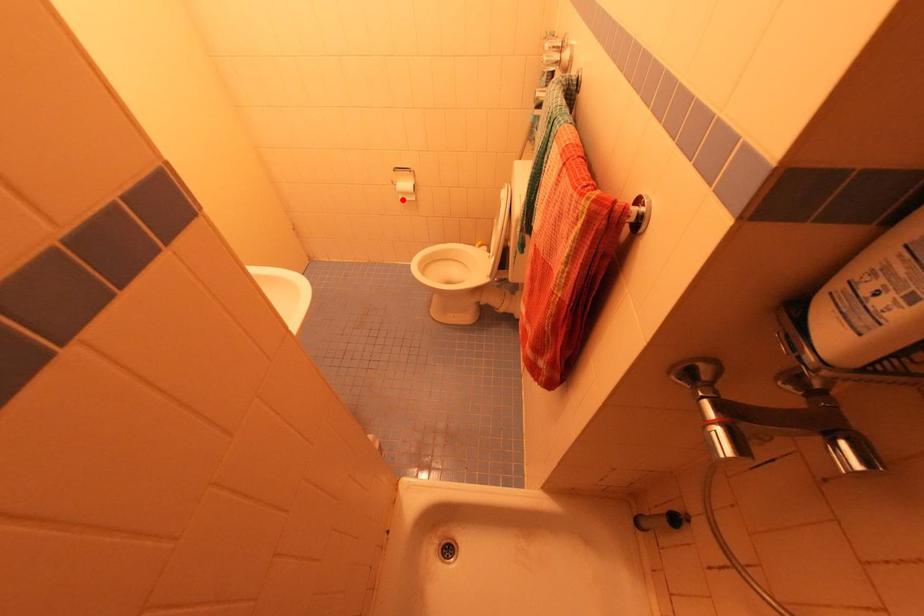
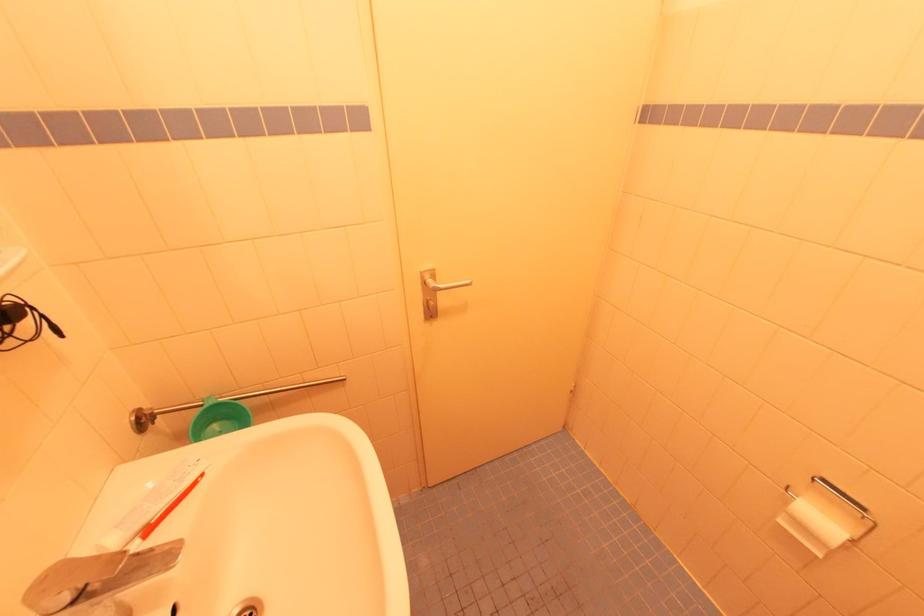
Question: I am providing you with two images of the same scene from different viewpoints. In image1, a red point is highlighted. Considering the same 3D point in image2, which of the following is correct?

Choices:
 (A) It is closer
 (B) It is farther

Answer: (B)